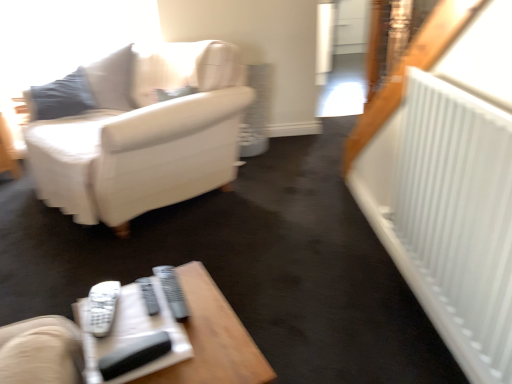
The image size is (512, 384). I want to click on free space in front of gray plastic remote at center, which appears as the first remote when viewed from the right, so click(x=198, y=350).